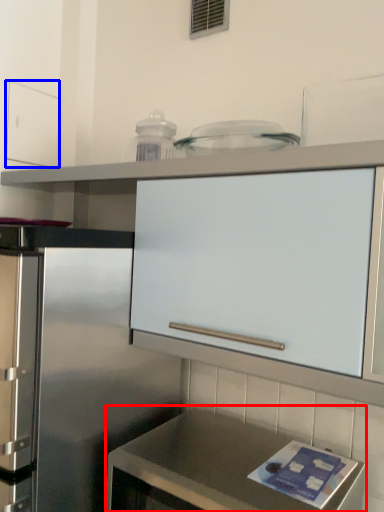
Question: Which object appears closest to the camera in this image, countertop (highlighted by a red box) or drawer (highlighted by a blue box)?

Choices:
 (A) countertop
 (B) drawer

Answer: (A)